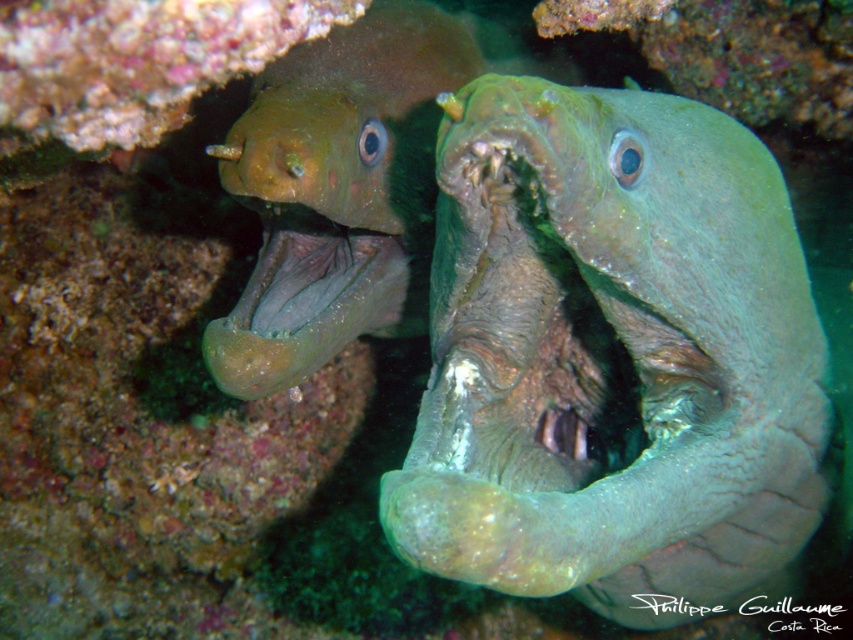
Can you confirm if green rough skin at center is positioned to the left of green matte moray eel at upper left?

No, green rough skin at center is not to the left of green matte moray eel at upper left.

Does green rough skin at center have a lesser height compared to green matte moray eel at upper left?

No, green rough skin at center is not shorter than green matte moray eel at upper left.

Locate an element on the screen. green rough skin at center is located at coordinates (612, 356).

What are the coordinates of `green rough skin at center` in the screenshot? It's located at (612, 356).